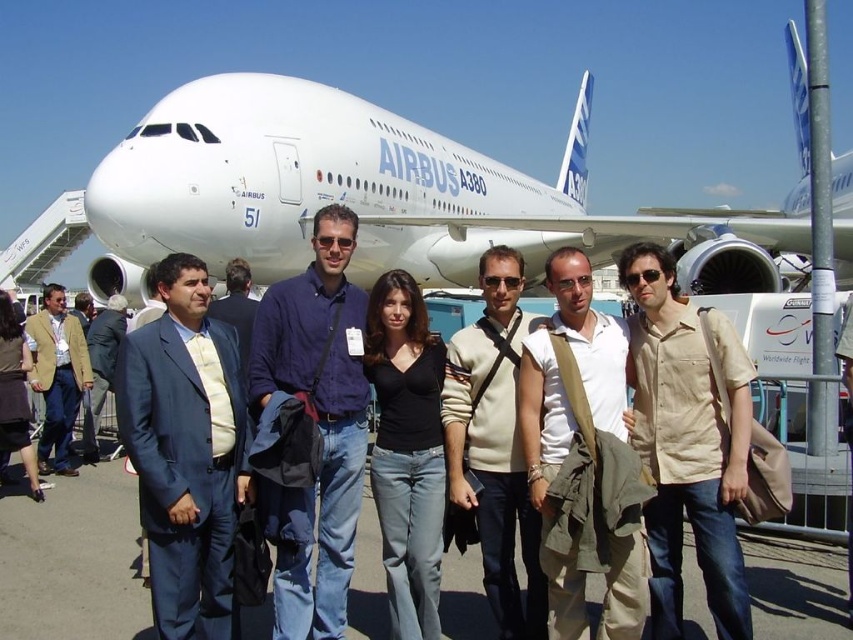
Question: Does smooth concrete tarmac at center have a smaller size compared to matte yellow blazer at left?

Choices:
 (A) yes
 (B) no

Answer: (B)

Question: Which object appears farthest from the camera in this image?

Choices:
 (A) white glossy airplane at upper center
 (B) beige sweater at center
 (C) black matte shirt at center
 (D) matte yellow blazer at left

Answer: (A)

Question: Which object is positioned farthest from the matte blue suit at center?

Choices:
 (A) matte yellow blazer at left
 (B) black matte shirt at center
 (C) tan canvas bag at center

Answer: (A)

Question: Among these points, which one is nearest to the camera?

Choices:
 (A) (323, 611)
 (B) (433, 566)
 (C) (473, 472)

Answer: (A)

Question: Does white glossy airplane at upper center appear on the right side of tan canvas bag at center?

Choices:
 (A) no
 (B) yes

Answer: (B)

Question: Does matte blue suit at center appear under tan canvas bag at center?

Choices:
 (A) yes
 (B) no

Answer: (A)